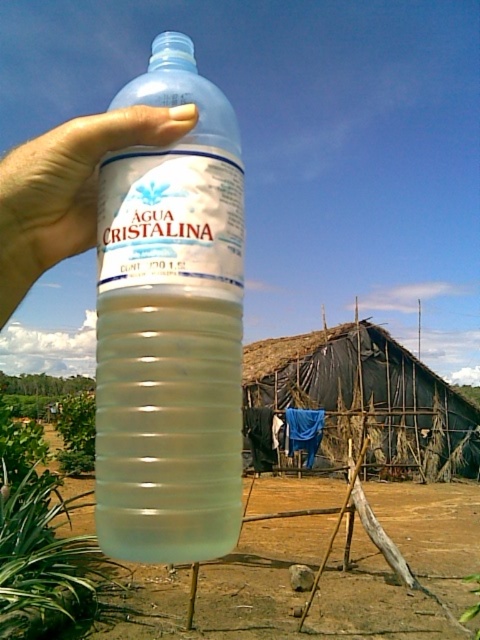
In the scene shown: You are designing a poster and need to know the spatial relationship between the translucent plastic dirt field at center and the transparent plastic hand at upper left. Based on the image, which object occupies more horizontal space?

The translucent plastic dirt field at center might be wider than transparent plastic hand at upper left according to the description.

You are standing in front of the rustic structure and want to hang a new piece of clothing. There are two points marked on the structure where you can hang it. The points are labeled as point (240,275) and point (72,186). Which point is closer to you if you are facing the structure?

Point (240,275) is in front of point (72,186), so the point closer to you when facing the structure is point (240,275).